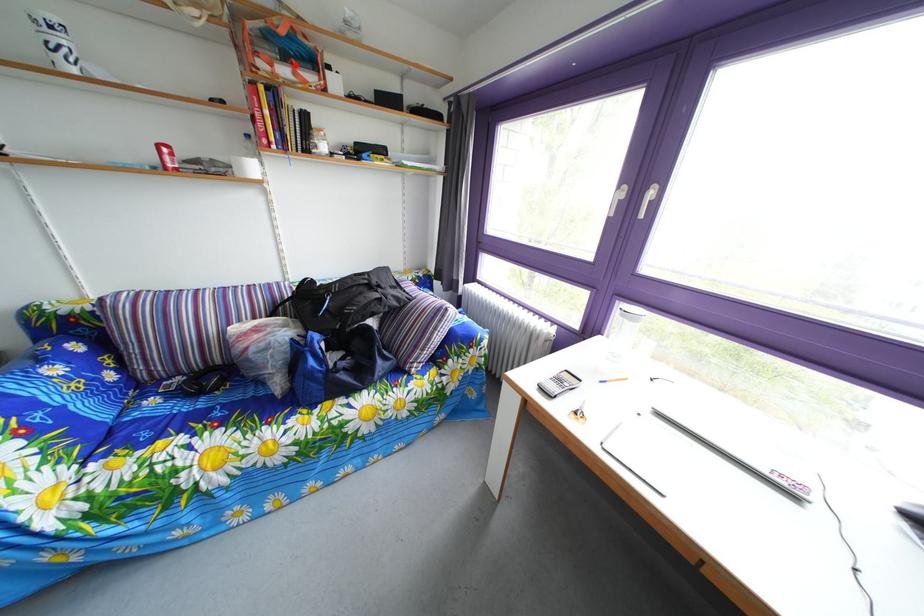
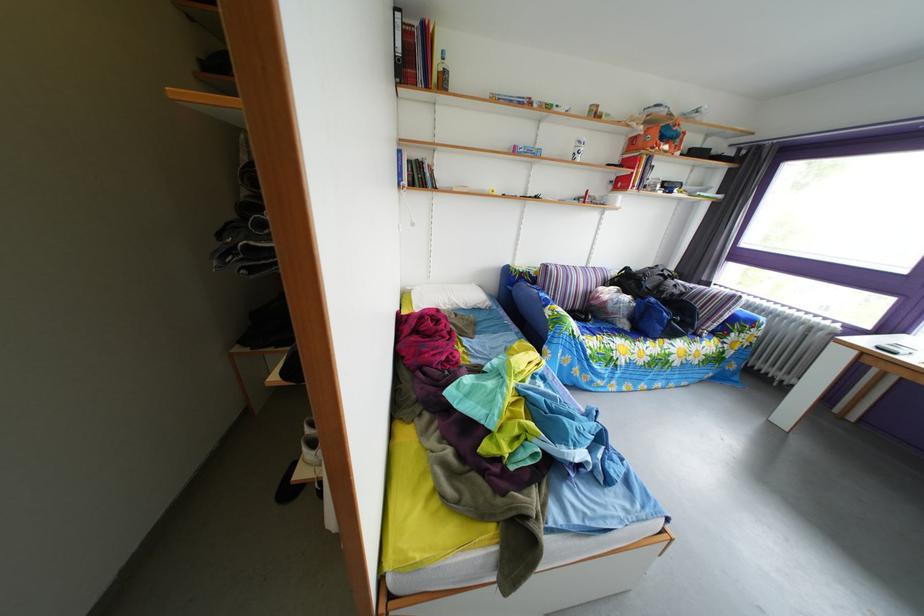
Find the pixel in the second image that matches the highlighted location in the first image.

(673, 147)